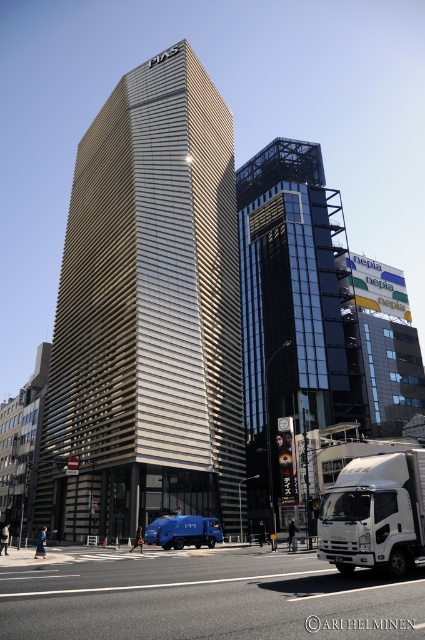
You are a city planner reviewing the urban layout. The point at coordinates (x=292, y=310) marks a specific location. Which building does this point correspond to?

The point at coordinates (x=292, y=310) corresponds to the glassy steel tower at center.

You are a city planner assessing the urban layout. You need to determine if the white glossy trailer truck at lower right can fit through a narrow alley that is as wide as the glassy steel tower at center. Based on their widths, what is your conclusion?

The glassy steel tower at center is wider than the white glossy trailer truck at lower right. Since the alley is as wide as the tower, the truck cannot fit through it because it is narrower than the tower but wider than the alley would allow. Wait, actually, if the alley is as wide as the tower, and the truck is narrower than the tower, then the truck should fit. Hmm, maybe I need to rephrase. Let me check the description again. The tower is wider than the truck. The alley is as wide as the tower, so the tr